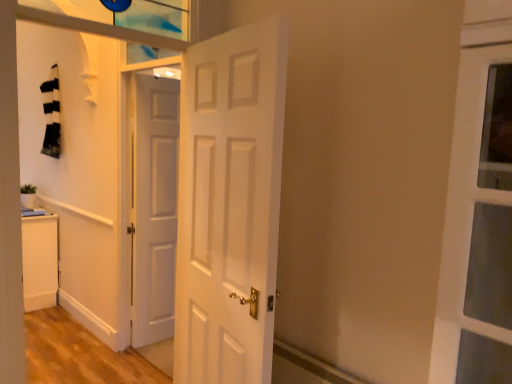
Identify the location of free spot above white matte door at center, positioned as the second door in front-to-back order (from a real-world perspective). (159, 79).